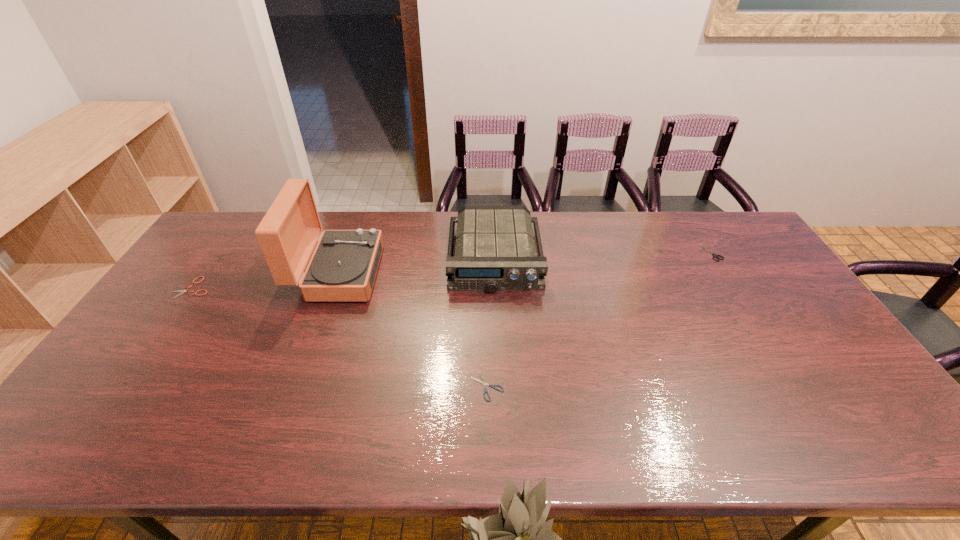
Locate an element on the screen. vacant space that's between the fourth shortest object and the tallest object is located at coordinates (417, 266).

Where is `free space between the third tallest object and the shortest shears`? This screenshot has height=540, width=960. free space between the third tallest object and the shortest shears is located at coordinates (600, 319).

Identify the location of free space between the rightmost object and the radio receiver. (604, 255).

Locate an element on the screen. This screenshot has height=540, width=960. free space between the rightmost shears and the second tallest object is located at coordinates (604, 255).

The image size is (960, 540). Find the location of `vacant area that lies between the nearest shears and the third shortest object`. vacant area that lies between the nearest shears and the third shortest object is located at coordinates (600, 319).

The image size is (960, 540). I want to click on the closest object relative to the third shortest object, so tap(495, 250).

The width and height of the screenshot is (960, 540). In order to click on the closest object to the fourth tallest object in this screenshot , I will do `click(343, 267)`.

Where is `shears that is the second closest to the leftmost shears`? This screenshot has width=960, height=540. shears that is the second closest to the leftmost shears is located at coordinates (715, 255).

Locate an element on the screen. The width and height of the screenshot is (960, 540). shears that is the second closest to the nearest object is located at coordinates (182, 291).

Where is `free space in the image that satisfies the following two spatial constraints: 1. on the face of the shortest object; 2. on the right side of the phonograph record`? free space in the image that satisfies the following two spatial constraints: 1. on the face of the shortest object; 2. on the right side of the phonograph record is located at coordinates (298, 387).